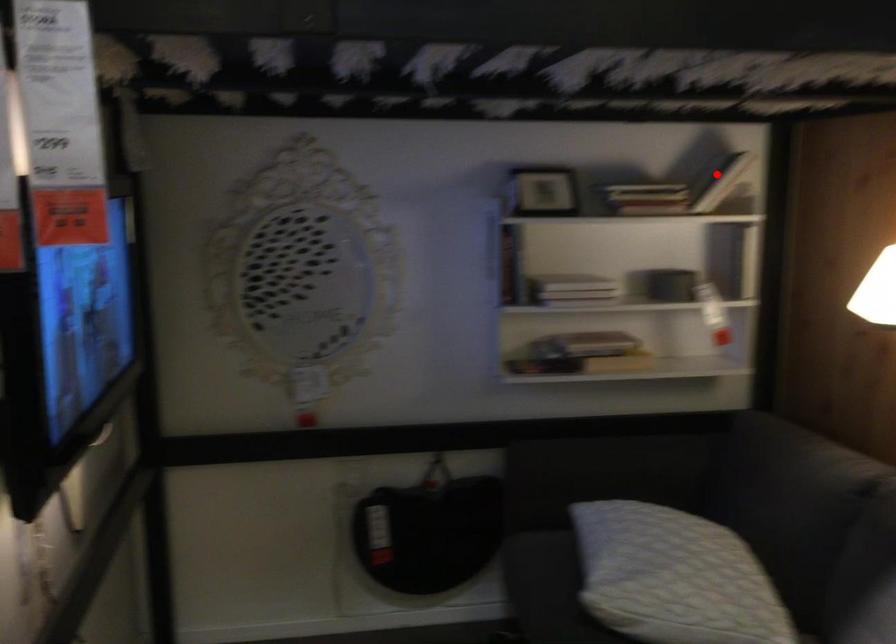
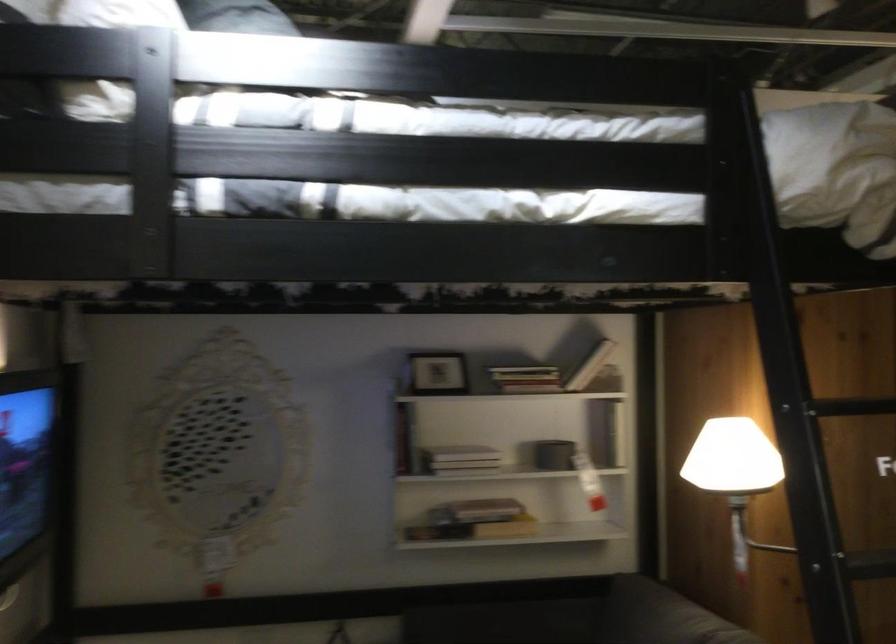
Question: I am providing you with two images of the same scene from different viewpoints. A red point is shown in image1. For the corresponding object point in image2, is it positioned nearer or farther from the camera?

Choices:
 (A) Nearer
 (B) Farther

Answer: (B)